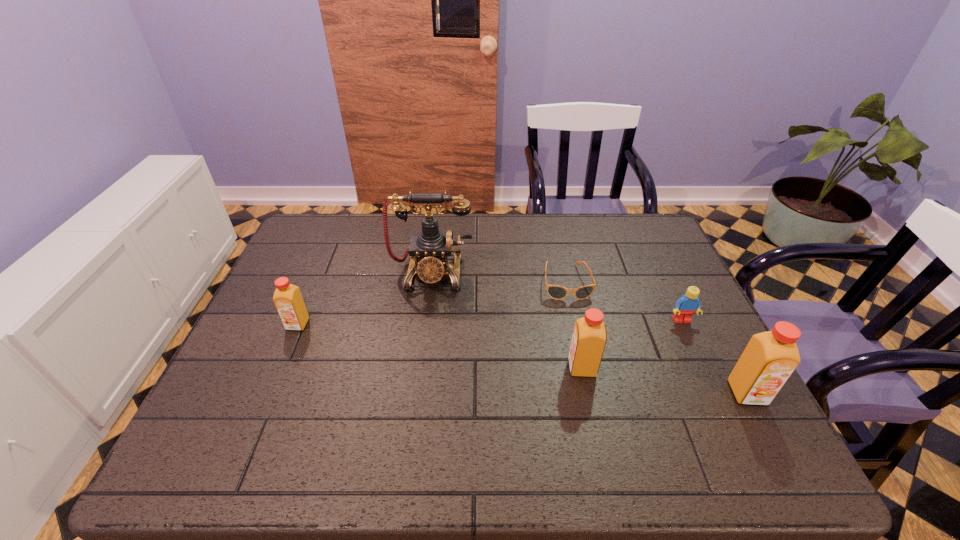
Where is `unoccupied area between the Lego and the second tallest orange juice`? The width and height of the screenshot is (960, 540). unoccupied area between the Lego and the second tallest orange juice is located at coordinates (632, 344).

At what (x,y) coordinates should I click in order to perform the action: click on vacant point located between the tallest object and the leftmost orange juice. Please return your answer as a coordinate pair (x, y). Looking at the image, I should click on (365, 299).

At what (x,y) coordinates should I click in order to perform the action: click on free space between the Lego and the second tallest orange juice. Please return your answer as a coordinate pair (x, y). This screenshot has width=960, height=540. Looking at the image, I should click on (632, 344).

At what (x,y) coordinates should I click in order to perform the action: click on empty location between the leftmost object and the nearest object. Please return your answer as a coordinate pair (x, y). The width and height of the screenshot is (960, 540). Looking at the image, I should click on (522, 359).

This screenshot has width=960, height=540. Find the location of `free space between the fifth object from right to left and the shortest orange juice`. free space between the fifth object from right to left and the shortest orange juice is located at coordinates (365, 299).

Image resolution: width=960 pixels, height=540 pixels. In order to click on empty space that is in between the second shortest object and the shortest object in this screenshot , I will do `click(624, 301)`.

I want to click on free spot between the fifth object from right to left and the sunglasses, so (498, 278).

Find the location of a particular element. free space between the fifth farthest object and the farthest orange juice is located at coordinates (440, 346).

Locate an element on the screen. the fourth closest object to the fifth object from right to left is located at coordinates (689, 303).

This screenshot has height=540, width=960. Find the location of `object identified as the closest to the telephone`. object identified as the closest to the telephone is located at coordinates (556, 292).